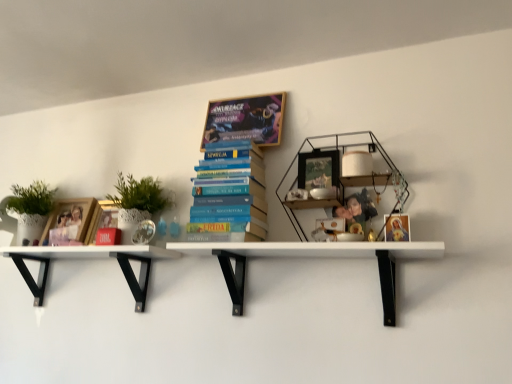
Question: In the image, is matte wooden frame at left, which ranks as the 1th book cover in left-to-right order, on the left side or the right side of white matte shelf at lower left, acting as the 1th shelf starting from the left?

Choices:
 (A) right
 (B) left

Answer: (B)

Question: Looking at the image, does matte wooden frame at left, arranged as the 2th book cover when viewed from the front, seem bigger or smaller compared to white matte shelf at lower left, which is the second shelf in right-to-left order?

Choices:
 (A) small
 (B) big

Answer: (A)

Question: Estimate the real-world distances between objects in this image. Which object is farther from the matte wooden frame at left, which ranks as the 1th book cover in left-to-right order?

Choices:
 (A) white matte shelf at center, which is counted as the first shelf, starting from the right
 (B) blue hardcover books at center, the 1th book in the bottom-to-top sequence
 (C) matte gold frame at upper right, marked as the 2th book cover in a back-to-front arrangement
 (D) matte black picture frame at center
 (E) woodenmaterial/texturebookcase at upper right

Answer: (C)

Question: Which object is the farthest from the matte gold frame at upper right, marked as the 1th book cover in a right-to-left arrangement?

Choices:
 (A) matte wooden frame at left, placed as the 1th book cover when sorted from back to front
 (B) matte black picture frame at center
 (C) white matte shelf at center, which is counted as the first shelf, starting from the right
 (D) blue hardcover books at center, positioned as the second book in top-to-bottom order
 (E) woodenmaterial/texturebookcase at upper right

Answer: (A)